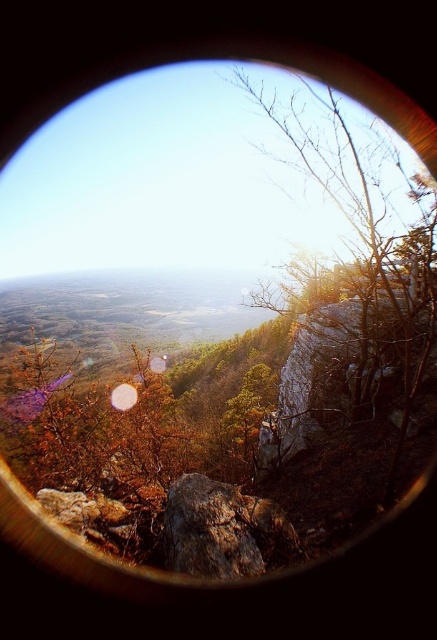
Question: Does brown textured tree at right appear over rusty rock at center?

Choices:
 (A) no
 (B) yes

Answer: (B)

Question: Which point is farther to the camera?

Choices:
 (A) (412, 179)
 (B) (124, 401)
 (C) (276, 506)

Answer: (B)

Question: Does rusty rock at center have a greater width compared to transparent glass lens at center?

Choices:
 (A) yes
 (B) no

Answer: (B)

Question: Based on their relative distances, which object is nearer to the rusty rock at center?

Choices:
 (A) brown textured tree at right
 (B) transparent glass lens at center

Answer: (A)

Question: Which point is farther to the camera?

Choices:
 (A) (357, 300)
 (B) (242, 499)

Answer: (A)

Question: Is rusty rock at center above transparent glass lens at center?

Choices:
 (A) yes
 (B) no

Answer: (A)